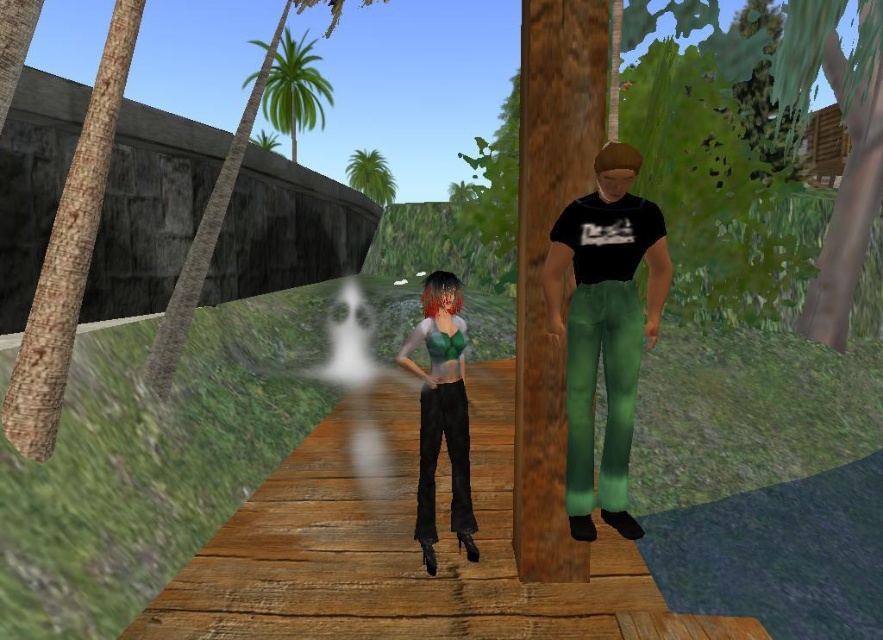
Question: Which of the following is the farthest from the observer?

Choices:
 (A) green leafy palm tree at upper left
 (B) green leafy palm tree at upper center
 (C) green matte top at center
 (D) wooden plank at center

Answer: (B)

Question: Based on their relative distances, which object is nearer to the green leafy palm tree at upper left?

Choices:
 (A) green matte top at center
 (B) black matte shirt at center

Answer: (B)

Question: Can you confirm if black matte shirt at center is positioned to the left of green matte top at center?

Choices:
 (A) no
 (B) yes

Answer: (A)

Question: Does wooden plank at center appear over green matte top at center?

Choices:
 (A) yes
 (B) no

Answer: (B)

Question: Does wooden plank at center have a lesser width compared to black matte shirt at center?

Choices:
 (A) yes
 (B) no

Answer: (B)

Question: Which object is closer to the camera taking this photo?

Choices:
 (A) green leafy palm tree at upper center
 (B) wooden plank at center
 (C) green matte top at center
 (D) black matte shirt at center

Answer: (D)